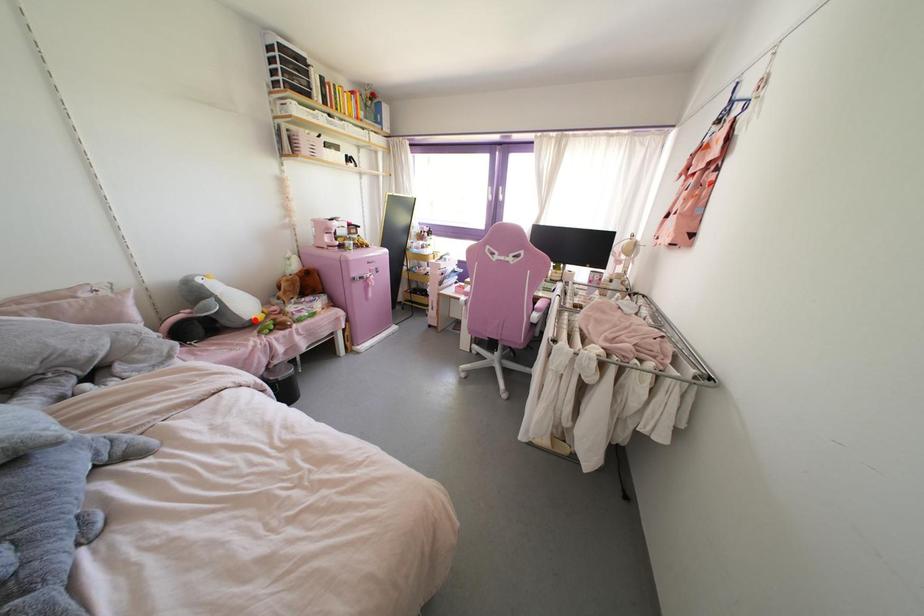
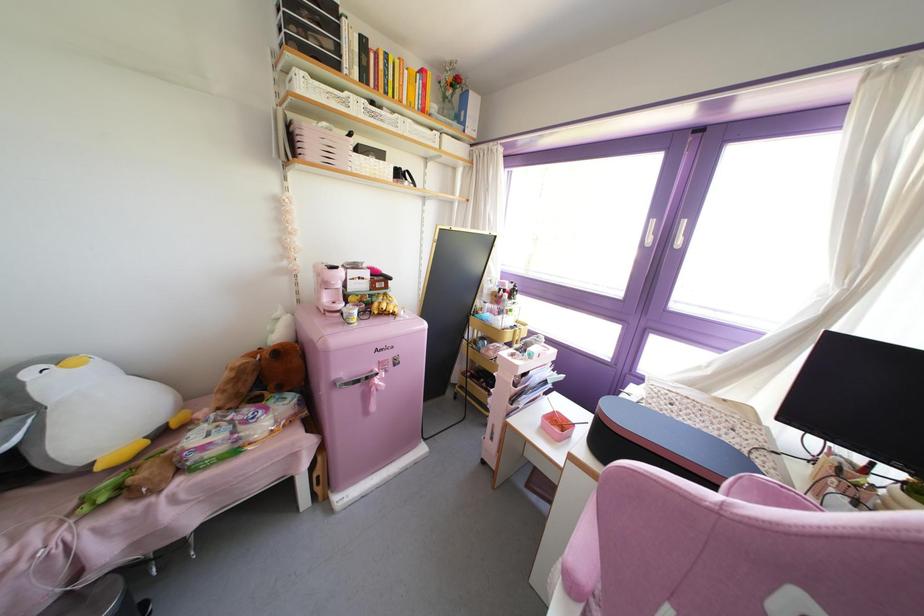
The point at the highlighted location is marked in the first image. Where is the corresponding point in the second image?

(99, 467)